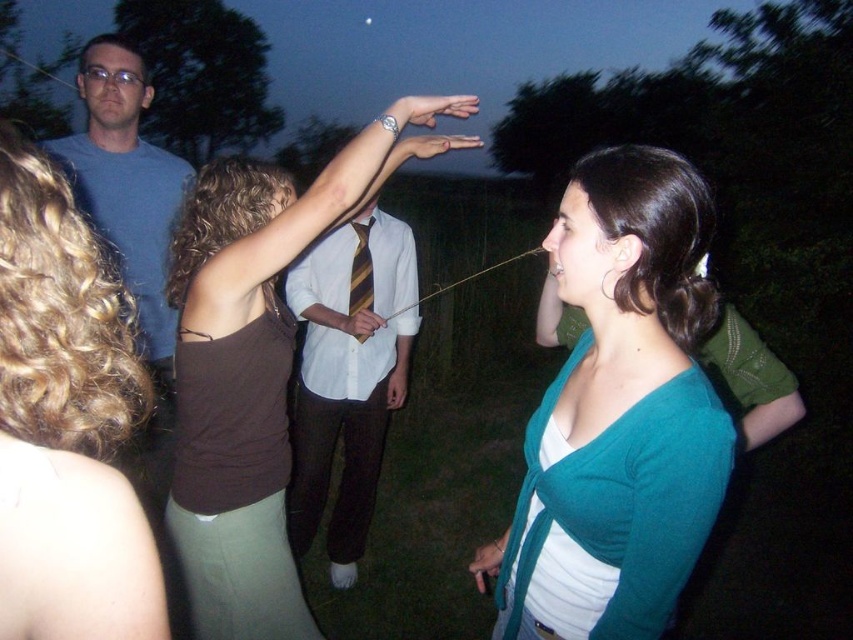
You are organizing a costume party and need to decide which item from the image will fit better into a small prop box. The teal knit cardigan at center and the yellow striped tie at center are both candidates. Based on their sizes, which item would you choose?

The yellow striped tie at center would fit better into the small prop box because it is smaller in size compared to the teal knit cardigan at center.